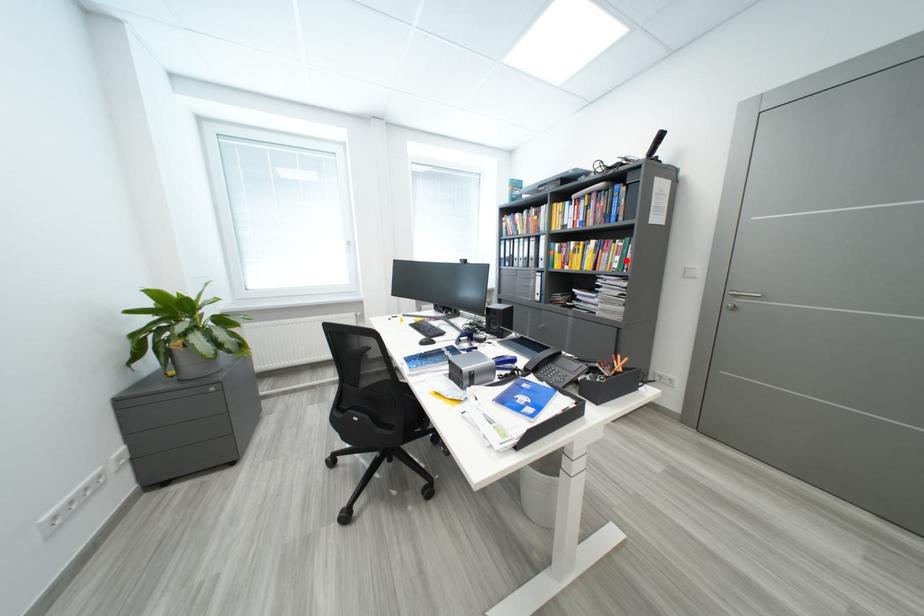
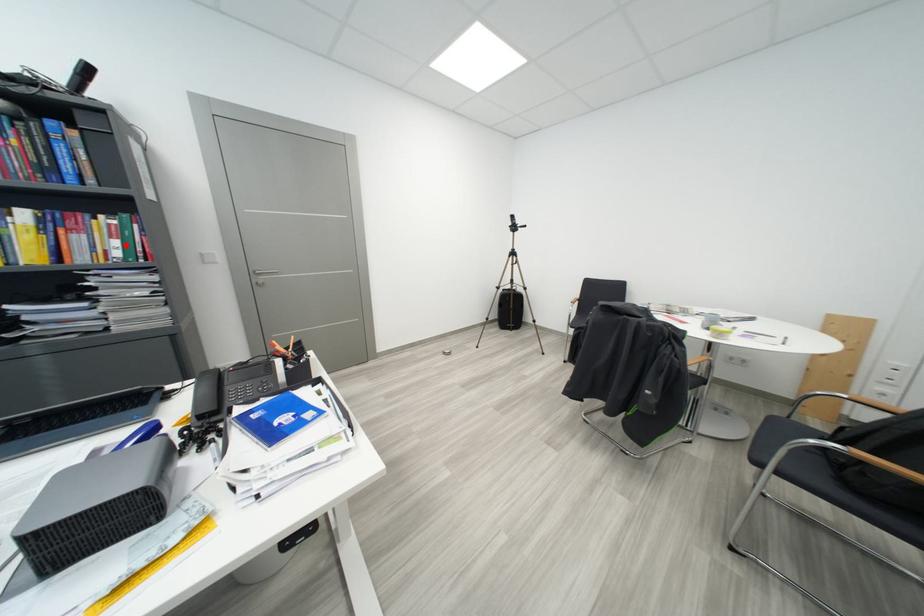
I am providing you with two images of the same scene from different viewpoints. A red point is marked on the first image and another point is marked on the second image. Are the points marked in image1 and image2 representing the same 3D position?

Yes